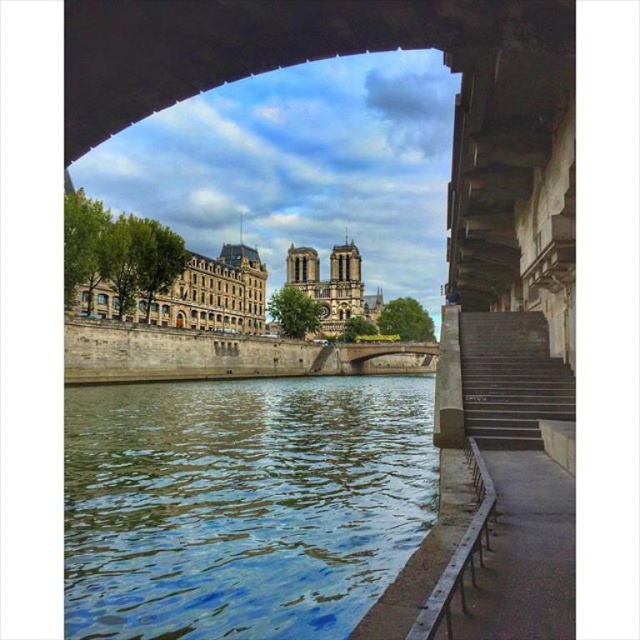
Question: Is blue water at lower left to the left of metallic gray rail at lower right from the viewer's perspective?

Choices:
 (A) no
 (B) yes

Answer: (B)

Question: Which of the following is the closest to the observer?

Choices:
 (A) (477, 477)
 (B) (262, 582)
 (C) (540, 417)

Answer: (B)

Question: Considering the real-world distances, which object is closest to the dark gray concrete stairs at right?

Choices:
 (A) metallic gray rail at lower right
 (B) blue water at lower left

Answer: (A)

Question: Does blue water at lower left have a larger size compared to dark gray concrete stairs at right?

Choices:
 (A) no
 (B) yes

Answer: (B)

Question: Is dark gray concrete stairs at right to the left of metallic gray rail at lower right from the viewer's perspective?

Choices:
 (A) yes
 (B) no

Answer: (B)

Question: Among these objects, which one is farthest from the camera?

Choices:
 (A) blue water at lower left
 (B) metallic gray rail at lower right
 (C) dark gray concrete stairs at right

Answer: (C)